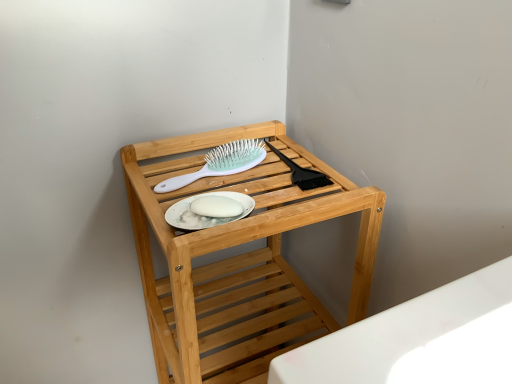
What is the approximate width of white plastic hairbrush at upper center?

The width of white plastic hairbrush at upper center is 8.75 inches.

Where is `natural wood shelf at center`? The image size is (512, 384). natural wood shelf at center is located at coordinates (239, 260).

Is white matte platter at center positioned with its back to natural wood shelf at center?

Correct, white matte platter at center is looking away from natural wood shelf at center.

Who is smaller, white matte platter at center or natural wood shelf at center?

white matte platter at center is smaller.

Relative to natural wood shelf at center, is white matte platter at center in front or behind?

white matte platter at center is positioned farther from the viewer than natural wood shelf at center.

Measure the distance between white matte platter at center and natural wood shelf at center.

They are 9.07 inches apart.

Based on their sizes in the image, would you say white plastic hairbrush at upper center is bigger or smaller than white matte platter at center?

Considering their sizes, white plastic hairbrush at upper center takes up more space than white matte platter at center.

Is white plastic hairbrush at upper center wider or thinner than white matte platter at center?

Clearly, white plastic hairbrush at upper center has more width compared to white matte platter at center.

The image size is (512, 384). Find the location of `platter below the white plastic hairbrush at upper center (from the image's perspective)`. platter below the white plastic hairbrush at upper center (from the image's perspective) is located at coordinates (205, 216).

In the image, is white plastic hairbrush at upper center positioned in front of or behind white matte platter at center?

In the image, white plastic hairbrush at upper center appears behind white matte platter at center.

What's the angular difference between white plastic hairbrush at upper center and natural wood shelf at center's facing directions?

The angular difference between white plastic hairbrush at upper center and natural wood shelf at center is 5.11 degrees.

From a real-world perspective, is white plastic hairbrush at upper center located higher than natural wood shelf at center?

Yes, from a real-world perspective, white plastic hairbrush at upper center is on top of natural wood shelf at center.

Would you say white plastic hairbrush at upper center is outside natural wood shelf at center?

No.

This screenshot has height=384, width=512. I want to click on furniture on the right side of white plastic hairbrush at upper center, so click(x=239, y=260).

Considering the relative sizes of natural wood shelf at center and white plastic hairbrush at upper center in the image provided, is natural wood shelf at center shorter than white plastic hairbrush at upper center?

Incorrect, the height of natural wood shelf at center does not fall short of that of white plastic hairbrush at upper center.

From the image's perspective, between natural wood shelf at center and white plastic hairbrush at upper center, which one is located above?

white plastic hairbrush at upper center is shown above in the image.

Is point (222, 271) closer to camera compared to point (164, 188)?

That is False.

Can you confirm if natural wood shelf at center is bigger than white matte platter at center?

Yes, natural wood shelf at center is bigger than white matte platter at center.

From the image's perspective, which is above, natural wood shelf at center or white matte platter at center?

From the image's view, white matte platter at center is above.

From a real-world perspective, between natural wood shelf at center and white matte platter at center, who is vertically higher?

white matte platter at center is physically above.

Considering the relative positions of natural wood shelf at center and white matte platter at center in the image provided, is natural wood shelf at center to the left of white matte platter at center from the viewer's perspective?

No.

Is the position of white matte platter at center less distant than that of white plastic hairbrush at upper center?

Yes, white matte platter at center is in front of white plastic hairbrush at upper center.

In the scene shown: Considering the positions of objects white matte platter at center and white plastic hairbrush at upper center in the image provided, who is more to the left, white matte platter at center or white plastic hairbrush at upper center?

white plastic hairbrush at upper center.

Measure the distance from white matte platter at center to white plastic hairbrush at upper center.

white matte platter at center and white plastic hairbrush at upper center are 4.22 inches apart.

Is white matte platter at center positioned beyond the bounds of white plastic hairbrush at upper center?

That's correct, white matte platter at center is outside of white plastic hairbrush at upper center.

You are a GUI agent. You are given a task and a screenshot of the screen. Output one action in this format:
    pyautogui.click(x=<x>, y=<y>)
    Task: Click on the furniture located in front of the white matte platter at center
    
    Given the screenshot: What is the action you would take?
    pyautogui.click(x=239, y=260)

Identify the location of platter located below the white plastic hairbrush at upper center (from the image's perspective). The image size is (512, 384). (205, 216).

Estimate the real-world distances between objects in this image. Which object is further from white plastic hairbrush at upper center, natural wood shelf at center or white matte platter at center?

natural wood shelf at center is positioned further to the anchor white plastic hairbrush at upper center.

When comparing their distances from white plastic hairbrush at upper center, does white matte platter at center or natural wood shelf at center seem further?

Among the two, natural wood shelf at center is located further to white plastic hairbrush at upper center.

Based on their spatial positions, is white matte platter at center or white plastic hairbrush at upper center further from natural wood shelf at center?

white matte platter at center lies further to natural wood shelf at center than the other object.

Looking at this image, which object lies nearer to the anchor point white matte platter at center, natural wood shelf at center or white plastic hairbrush at upper center?

white plastic hairbrush at upper center is closer to white matte platter at center.

Which object lies further to the anchor point natural wood shelf at center, white plastic hairbrush at upper center or white matte platter at center?

The object further to natural wood shelf at center is white matte platter at center.

Considering their positions, is white plastic hairbrush at upper center positioned further to white matte platter at center than natural wood shelf at center?

natural wood shelf at center lies further to white matte platter at center than the other object.

The image size is (512, 384). What are the coordinates of `platter between white plastic hairbrush at upper center and natural wood shelf at center in the up-down direction` in the screenshot? It's located at click(x=205, y=216).